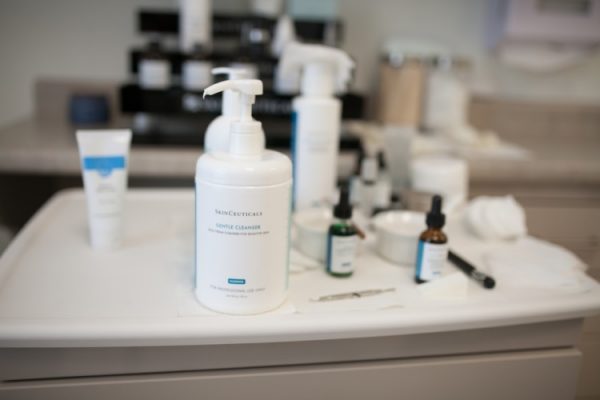
What are the coordinates of `lotion bottle` in the screenshot? It's located at (256, 195).